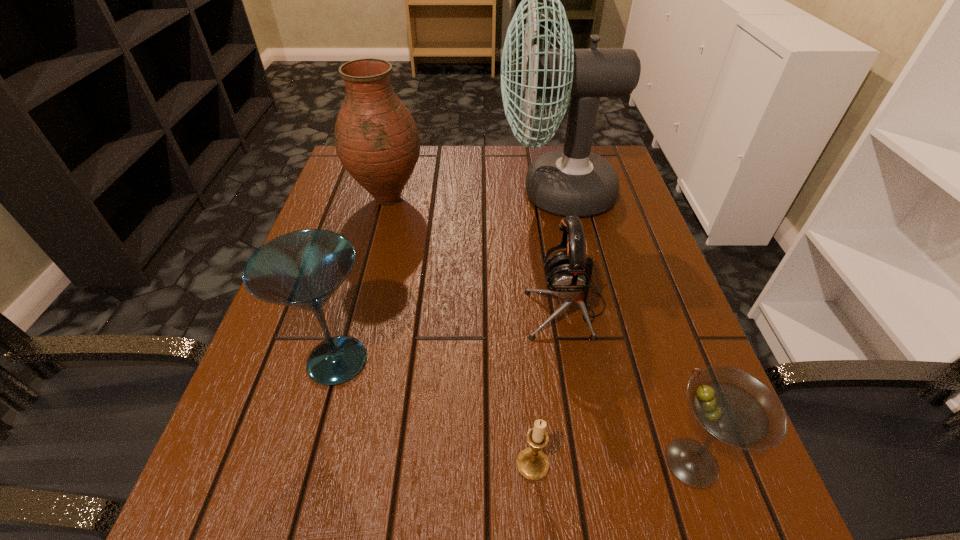
Locate an element on the screen. the tallest object is located at coordinates (573, 181).

Locate an element on the screen. This screenshot has height=540, width=960. the fifth shortest object is located at coordinates point(377,140).

Locate an element on the screen. the taller martini is located at coordinates (302, 269).

Find the location of a particular element. the farther martini is located at coordinates point(302,269).

Find the location of a particular element. earphone is located at coordinates (569, 272).

At what (x,y) coordinates should I click in order to perform the action: click on the shorter martini. Please return your answer as a coordinate pair (x, y). This screenshot has width=960, height=540. Looking at the image, I should click on (733, 406).

Where is `the right martini`? the right martini is located at coordinates (733, 406).

Find the location of `the shortest object`. the shortest object is located at coordinates pyautogui.click(x=532, y=463).

You are a GUI agent. You are given a task and a screenshot of the screen. Output one action in this format:
    pyautogui.click(x=<x>, y=<y>)
    Task: Click on the vacant space positioned 0.230m in front of the fan where the airflow is directed
    The height and width of the screenshot is (540, 960).
    Given the screenshot: What is the action you would take?
    pyautogui.click(x=407, y=193)

Find the location of a particular element. free space located 0.330m in front of the fan where the airflow is directed is located at coordinates (368, 193).